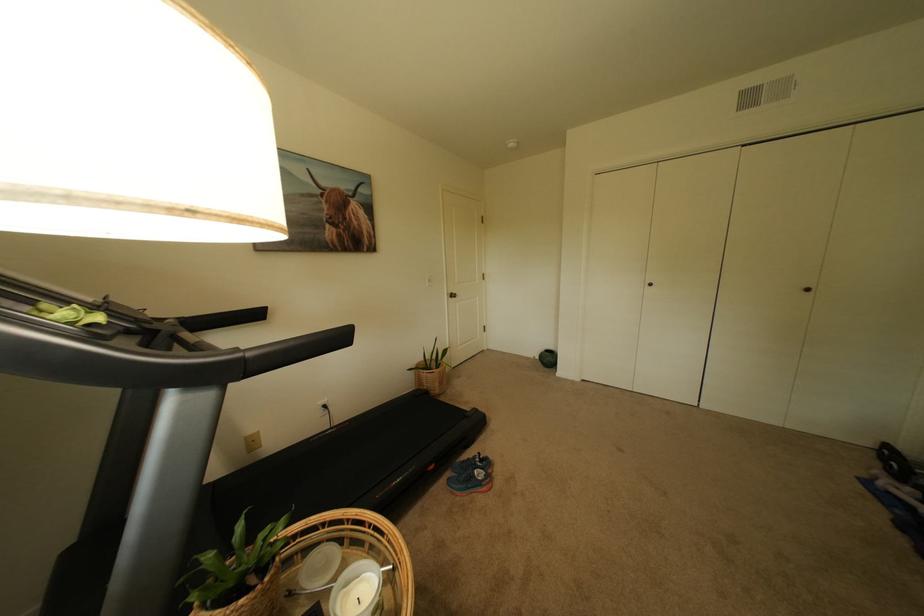
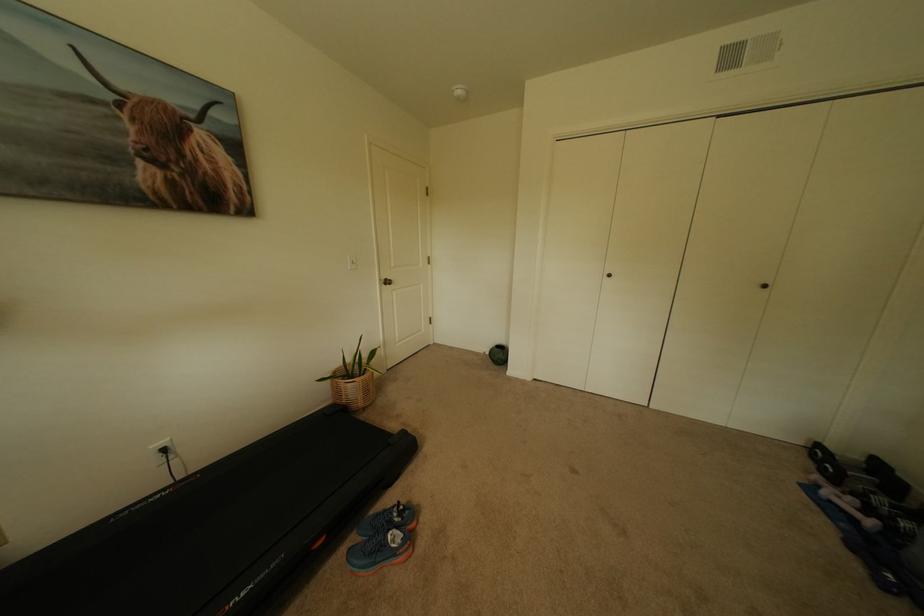
In a continuous first-person perspective shot, in which direction is the camera moving?

The movement direction of the cameraman is right, forward.